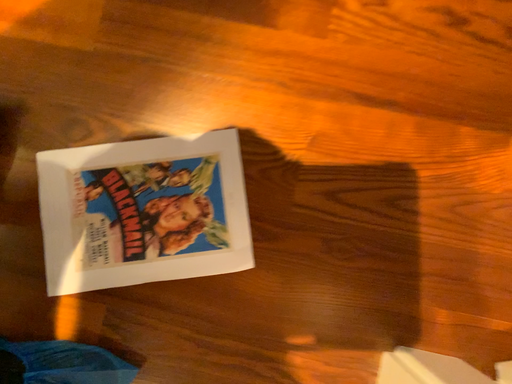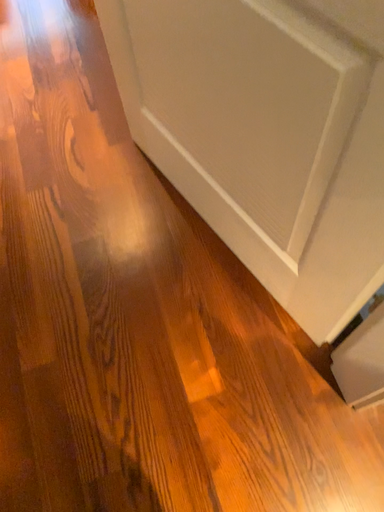
Question: How did the camera likely rotate when shooting the video?

Choices:
 (A) rotated upward
 (B) rotated downward

Answer: (A)